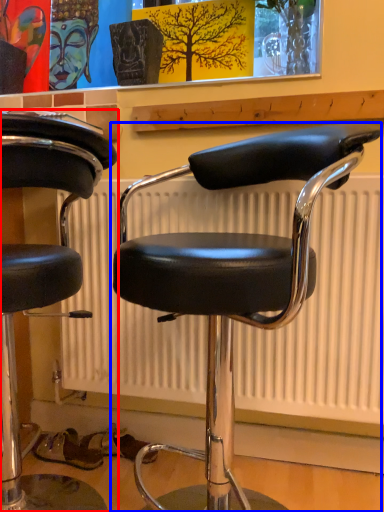
Question: Which point is closer to the camera, chair (highlighted by a red box) or chair (highlighted by a blue box)?

Choices:
 (A) chair
 (B) chair

Answer: (B)